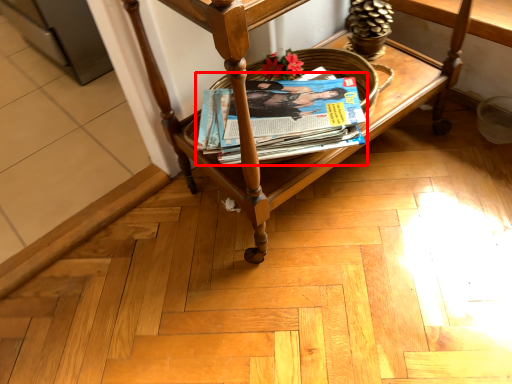
Question: From the image's perspective, considering the relative positions of magazine (annotated by the red box) and furniture in the image provided, where is magazine (annotated by the red box) located with respect to the staircase?

Choices:
 (A) below
 (B) above

Answer: (A)